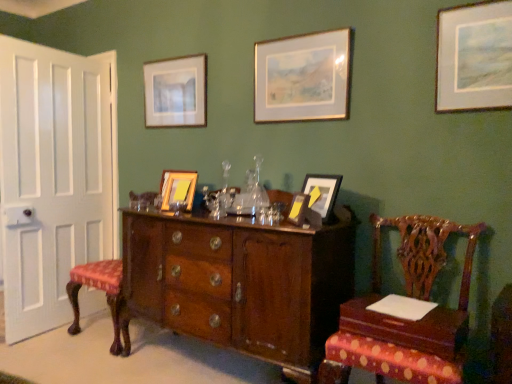
You are a GUI agent. You are given a task and a screenshot of the screen. Output one action in this format:
    pyautogui.click(x=<x>, y=<y>)
    Task: Click on the free spot below wooden chair with upholstered seat at left, which is the 1th chair in back-to-front order (from a real-world perspective)
    The height and width of the screenshot is (384, 512).
    Given the screenshot: What is the action you would take?
    pyautogui.click(x=109, y=334)